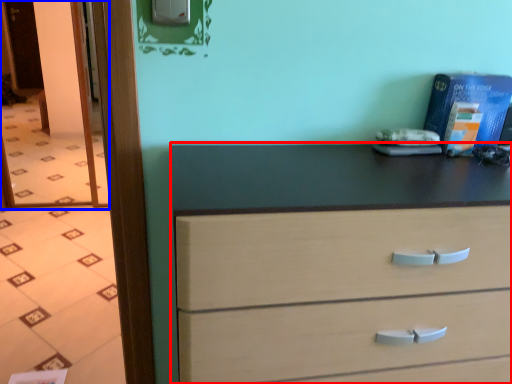
Question: Which object appears closest to the camera in this image, chest of drawers (highlighted by a red box) or glass door (highlighted by a blue box)?

Choices:
 (A) chest of drawers
 (B) glass door

Answer: (A)